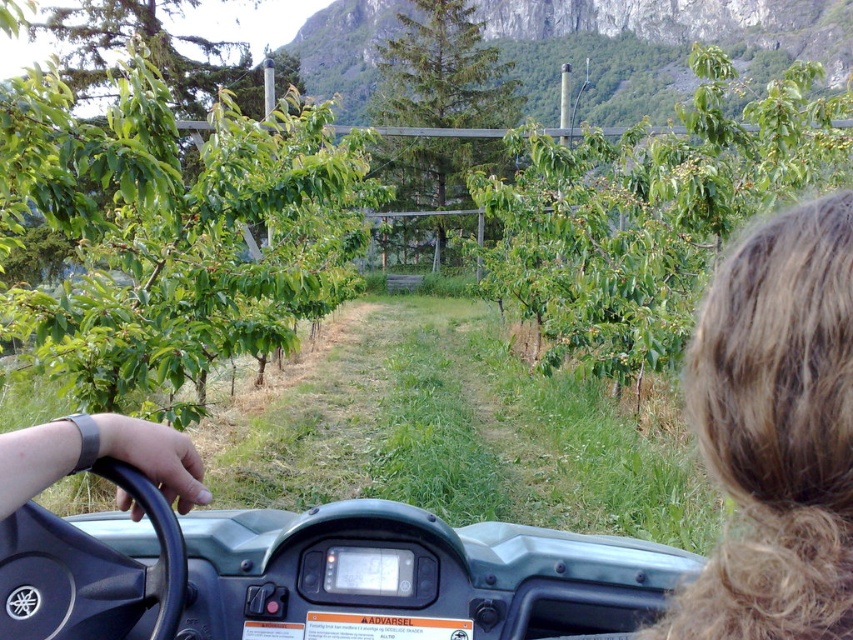
Question: Is green leafy tree at left to the right of gray rubber wristband at lower left from the viewer's perspective?

Choices:
 (A) yes
 (B) no

Answer: (B)

Question: Is green leafy tree at center closer to the viewer compared to green matte tree at center?

Choices:
 (A) no
 (B) yes

Answer: (B)

Question: Which of the following is the farthest from the observer?

Choices:
 (A) gray rubber wristband at lower left
 (B) green matte tree at center
 (C) green leafy tree at center
 (D) green leafy tree at left

Answer: (B)

Question: Which of the following is the farthest from the observer?

Choices:
 (A) (422, 246)
 (B) (688, 218)
 (C) (151, 152)
 (D) (94, 452)

Answer: (A)

Question: Which object is the closest to the green leafy tree at center?

Choices:
 (A) green matte tree at center
 (B) gray rubber wristband at lower left
 (C) blonde hair at upper right
 (D) green leafy tree at left

Answer: (A)

Question: Can you confirm if green leafy tree at center is positioned above green matte tree at center?

Choices:
 (A) yes
 (B) no

Answer: (B)